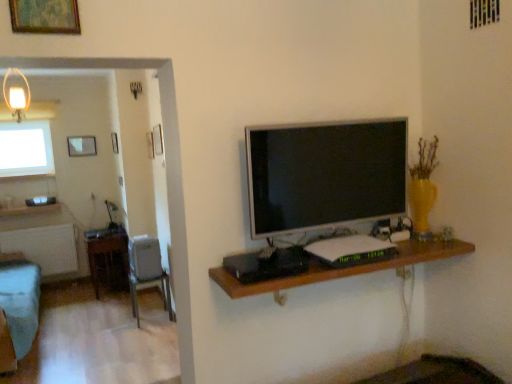
Question: Is matte glass lampshade at upper left facing away from metallic gray chair at lower left?

Choices:
 (A) no
 (B) yes

Answer: (A)

Question: Can you confirm if matte glass lampshade at upper left is bigger than metallic gray chair at lower left?

Choices:
 (A) yes
 (B) no

Answer: (B)

Question: Is matte glass lampshade at upper left outside of metallic gray chair at lower left?

Choices:
 (A) no
 (B) yes

Answer: (B)

Question: From the image's perspective, does matte glass lampshade at upper left appear higher than metallic gray chair at lower left?

Choices:
 (A) no
 (B) yes

Answer: (B)

Question: Is matte glass lampshade at upper left in contact with metallic gray chair at lower left?

Choices:
 (A) no
 (B) yes

Answer: (A)

Question: Considering the relative positions of matte glass lampshade at upper left and metallic gray chair at lower left in the image provided, is matte glass lampshade at upper left to the right of metallic gray chair at lower left from the viewer's perspective?

Choices:
 (A) no
 (B) yes

Answer: (A)

Question: Is matte glass picture frame at upper left, which is the first picture frame from left to right, positioned before gold-framed artwork at upper left, the third picture frame when ordered from back to front?

Choices:
 (A) no
 (B) yes

Answer: (A)

Question: Is matte glass picture frame at upper left, the 1th picture frame from the back, in contact with gold-framed artwork at upper left, positioned as the 1th picture frame in right-to-left order?

Choices:
 (A) yes
 (B) no

Answer: (B)

Question: Considering the relative sizes of matte glass picture frame at upper left, the 1th picture frame from the back, and gold-framed artwork at upper left, the first picture frame viewed from the front, in the image provided, is matte glass picture frame at upper left, the 1th picture frame from the back, smaller than gold-framed artwork at upper left, the first picture frame viewed from the front,?

Choices:
 (A) yes
 (B) no

Answer: (B)

Question: Does matte glass picture frame at upper left, which is the first picture frame from left to right, appear on the left side of gold-framed artwork at upper left, the third picture frame when ordered from back to front?

Choices:
 (A) yes
 (B) no

Answer: (A)

Question: Can you confirm if matte glass picture frame at upper left, arranged as the third picture frame when viewed from the right, is wider than gold-framed artwork at upper left, the third picture frame positioned from the left?

Choices:
 (A) yes
 (B) no

Answer: (A)

Question: Does matte glass picture frame at upper left, arranged as the third picture frame when viewed from the right, have a larger size compared to gold-framed artwork at upper left, the third picture frame positioned from the left?

Choices:
 (A) no
 (B) yes

Answer: (B)

Question: Is wooden table at left to the left of wooden shelf at center from the viewer's perspective?

Choices:
 (A) yes
 (B) no

Answer: (A)